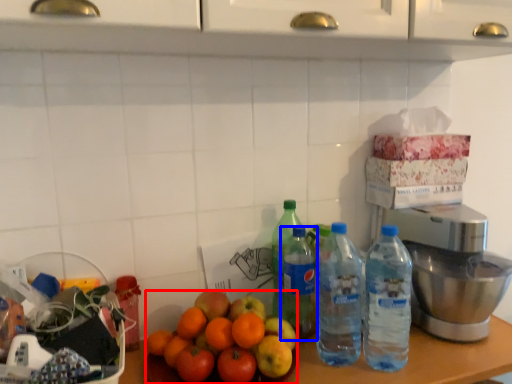
Question: Which of the following is the farthest to the observer, orange (highlighted by a red box) or bottle (highlighted by a blue box)?

Choices:
 (A) orange
 (B) bottle

Answer: (B)